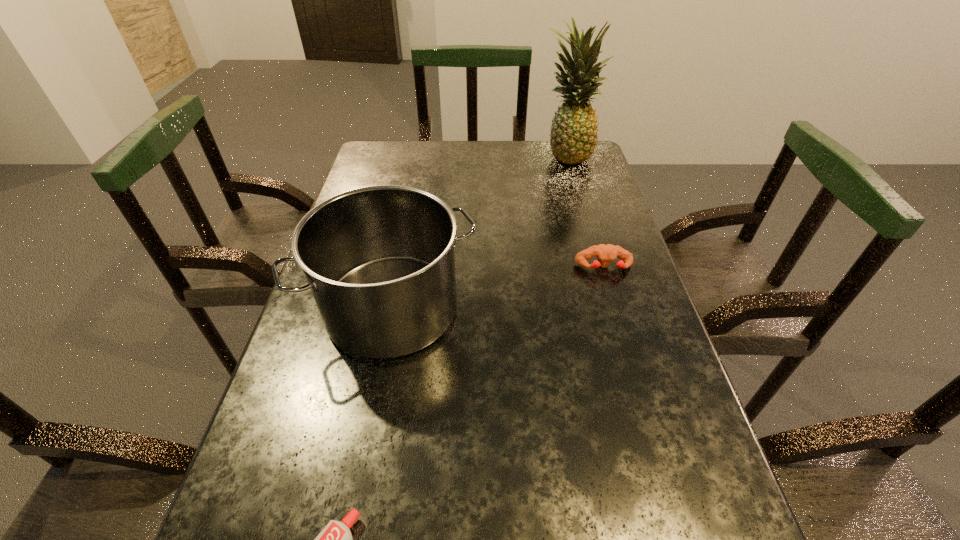
Where is `free spot between the third shortest object and the pineapple`? The height and width of the screenshot is (540, 960). free spot between the third shortest object and the pineapple is located at coordinates (479, 232).

This screenshot has height=540, width=960. I want to click on the third closest object to the shortest object, so (573, 137).

Select which object is the third closest to the saucepan. Please provide its 2D coordinates. Your answer should be formatted as a tuple, i.e. [(x, y)], where the tuple contains the x and y coordinates of a point satisfying the conditions above.

[(573, 137)]